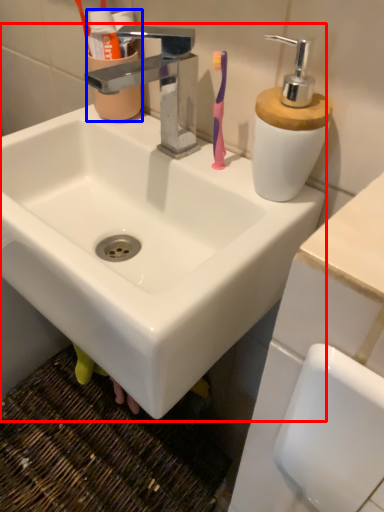
Question: Which object is closer to the camera taking this photo, sink (highlighted by a red box) or mouthwash (highlighted by a blue box)?

Choices:
 (A) sink
 (B) mouthwash

Answer: (A)